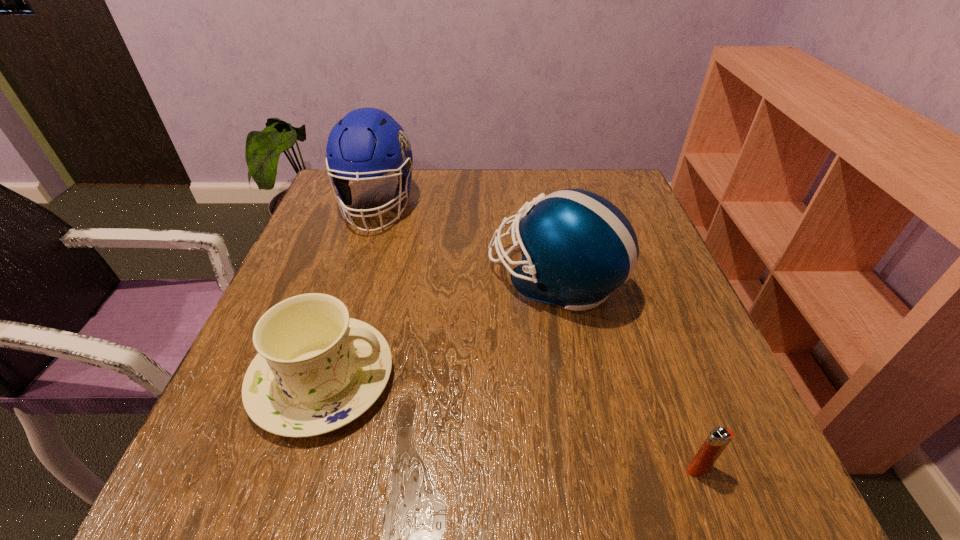
The height and width of the screenshot is (540, 960). In order to click on blank area located at the front of the nearer football helmet with the faceguard in this screenshot , I will do `click(445, 279)`.

Where is `vacant space situated 0.400m at the front of the nearer football helmet with the faceguard`? Image resolution: width=960 pixels, height=540 pixels. vacant space situated 0.400m at the front of the nearer football helmet with the faceguard is located at coordinates (297, 279).

Where is `vacant position located 0.160m on the handle side of the third farthest object`? This screenshot has height=540, width=960. vacant position located 0.160m on the handle side of the third farthest object is located at coordinates (489, 379).

At what (x,y) coordinates should I click in order to perform the action: click on free space located on the back of the nearest object. Please return your answer as a coordinate pair (x, y). The height and width of the screenshot is (540, 960). Looking at the image, I should click on (667, 384).

Image resolution: width=960 pixels, height=540 pixels. What are the coordinates of `object present at the far edge` in the screenshot? It's located at (367, 143).

In order to click on object present at the near edge in this screenshot , I will do `click(718, 439)`.

The image size is (960, 540). What are the coordinates of `football helmet that is at the left edge` in the screenshot? It's located at (367, 143).

Where is `chinaware at the left edge`? chinaware at the left edge is located at coordinates 317,370.

The image size is (960, 540). Identify the location of football helmet positioned at the right edge. (577, 247).

Locate an element on the screen. The image size is (960, 540). igniter present at the right edge is located at coordinates (718, 439).